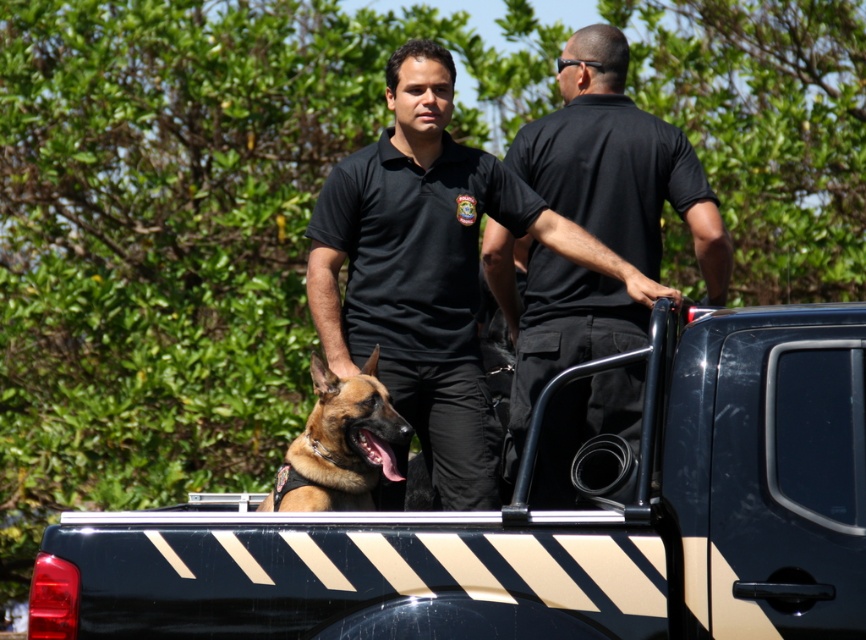
Can you confirm if metallic black truck bed at center is wider than black smooth shirt at upper right?

Indeed, metallic black truck bed at center has a greater width compared to black smooth shirt at upper right.

Between metallic black truck bed at center and black smooth shirt at upper right, which one appears on the right side from the viewer's perspective?

Positioned to the right is black smooth shirt at upper right.

Find the location of a particular element. This screenshot has height=640, width=866. metallic black truck bed at center is located at coordinates (541, 525).

Between black smooth shirt at upper right and brown fur dog at center, which one is positioned lower?

brown fur dog at center is lower down.

The height and width of the screenshot is (640, 866). What are the coordinates of `black smooth shirt at upper right` in the screenshot? It's located at (618, 163).

Looking at this image, is black cotton shirt at center above brown fur dog at center?

Yes.

Is point (396, 163) farther from viewer compared to point (320, 436)?

Yes, point (396, 163) is farther from viewer.

Locate an element on the screen. black cotton shirt at center is located at coordinates (430, 269).